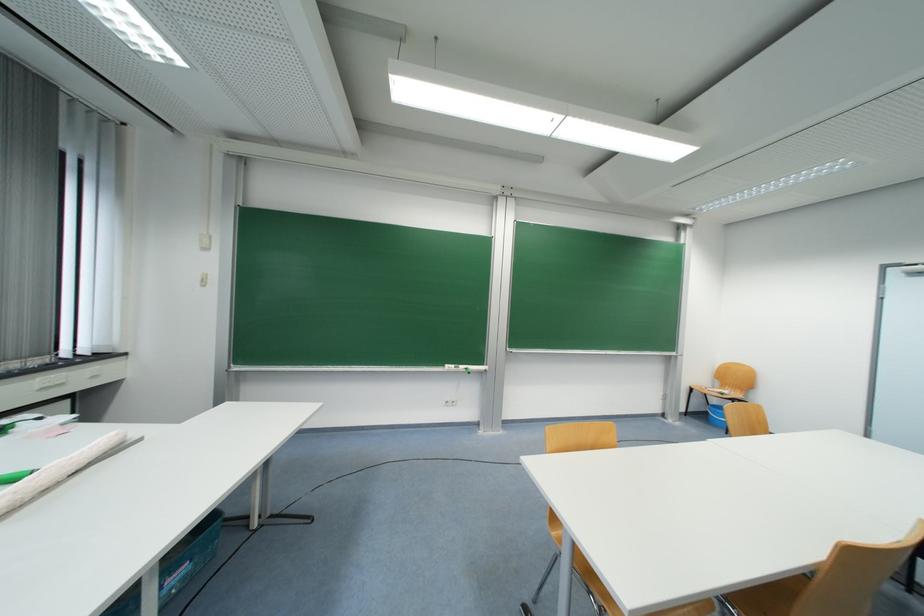
Where would you lift the blue plastic bucket? Please return your answer as a coordinate pair (x, y).

(716, 416)